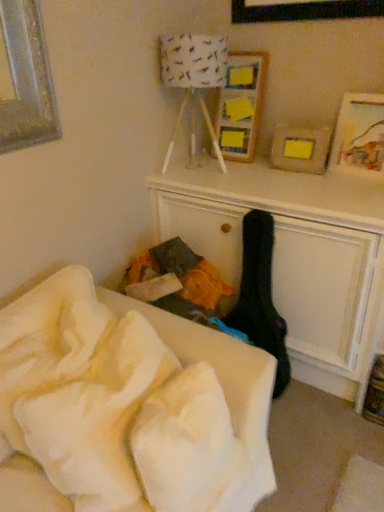
Locate an element on the screen. The width and height of the screenshot is (384, 512). wooden painted picture frame at upper right, the second picture frame viewed from the left is located at coordinates (360, 135).

This screenshot has width=384, height=512. Describe the element at coordinates (192, 68) in the screenshot. I see `white paper lampshade at upper center` at that location.

Describe the element at coordinates (260, 296) in the screenshot. I see `black fabric guitar case at center` at that location.

The height and width of the screenshot is (512, 384). Find the location of `wooden painted picture frame at upper right, the second picture frame viewed from the left`. wooden painted picture frame at upper right, the second picture frame viewed from the left is located at coordinates (360, 135).

Is black fabric guitar case at center positioned with its back to wooden painted picture frame at upper right, the second picture frame viewed from the left?

Yes, wooden painted picture frame at upper right, the second picture frame viewed from the left, is at the back of black fabric guitar case at center.

Image resolution: width=384 pixels, height=512 pixels. What are the coordinates of `the 1st picture frame above the black fabric guitar case at center (from the image's perspective)` in the screenshot? It's located at (360, 135).

Is the depth of black fabric guitar case at center greater than that of white paper lampshade at upper center?

No.

Is black fabric guitar case at center wider or thinner than white paper lampshade at upper center?

Clearly, black fabric guitar case at center has less width compared to white paper lampshade at upper center.

From a real-world perspective, which is physically above, black fabric guitar case at center or white paper lampshade at upper center?

From a 3D spatial view, white paper lampshade at upper center is above.

How distant is wooden painted picture frame at upper right, the second picture frame viewed from the left, from white paper lampshade at upper center?

wooden painted picture frame at upper right, the second picture frame viewed from the left, and white paper lampshade at upper center are 25.96 inches apart from each other.

Find the location of a particular element. picture frame located below the white paper lampshade at upper center (from the image's perspective) is located at coordinates (360, 135).

Who is more distant, wooden painted picture frame at upper right, the second picture frame viewed from the left, or white paper lampshade at upper center?

Positioned behind is wooden painted picture frame at upper right, the second picture frame viewed from the left.

Would you say wooden painted picture frame at upper right, the second picture frame viewed from the left, contains white paper lampshade at upper center?

No, white paper lampshade at upper center is not a part of wooden painted picture frame at upper right, the second picture frame viewed from the left.

Can you confirm if wooden painted picture frame at upper right, which is the first picture frame from right to left, is bigger than white soft blanket at lower left?

Incorrect, wooden painted picture frame at upper right, which is the first picture frame from right to left, is not larger than white soft blanket at lower left.

Considering the relative sizes of wooden painted picture frame at upper right, the second picture frame viewed from the left, and white soft blanket at lower left in the image provided, is wooden painted picture frame at upper right, the second picture frame viewed from the left, wider than white soft blanket at lower left?

Incorrect, the width of wooden painted picture frame at upper right, the second picture frame viewed from the left, does not surpass that of white soft blanket at lower left.

Which point is more distant from viewer, (355, 153) or (245, 377)?

The point (355, 153) is farther from the camera.

Locate an element on the screen. The height and width of the screenshot is (512, 384). furniture located on the left of wooden painted picture frame at upper right, the second picture frame viewed from the left is located at coordinates (128, 406).

Is wooden picture frame at upper center, placed as the second picture frame when sorted from right to left, looking in the opposite direction of black fabric guitar case at center?

No, wooden picture frame at upper center, placed as the second picture frame when sorted from right to left, is not facing the opposite direction of black fabric guitar case at center.

In the scene shown: Who is taller, wooden picture frame at upper center, which is counted as the first picture frame, starting from the left, or black fabric guitar case at center?

black fabric guitar case at center.

Would you consider wooden picture frame at upper center, placed as the second picture frame when sorted from right to left, to be distant from black fabric guitar case at center?

No, wooden picture frame at upper center, placed as the second picture frame when sorted from right to left, is in close proximity to black fabric guitar case at center.

From the image's perspective, is wooden picture frame at upper center, which is counted as the first picture frame, starting from the left, under black fabric guitar case at center?

No.

Between wooden painted picture frame at upper right, the second picture frame viewed from the left, and wooden picture frame at upper center, placed as the second picture frame when sorted from right to left, which one has smaller width?

wooden painted picture frame at upper right, the second picture frame viewed from the left.

Find the location of `picture frame that appears below the wooden picture frame at upper center, which is counted as the first picture frame, starting from the left (from a real-world perspective)`. picture frame that appears below the wooden picture frame at upper center, which is counted as the first picture frame, starting from the left (from a real-world perspective) is located at coordinates (360, 135).

Does wooden painted picture frame at upper right, the second picture frame viewed from the left, turn towards wooden picture frame at upper center, placed as the second picture frame when sorted from right to left?

No, wooden painted picture frame at upper right, the second picture frame viewed from the left, does not turn towards wooden picture frame at upper center, placed as the second picture frame when sorted from right to left.

Based on the photo, from the image's perspective, is wooden picture frame at upper center, which is counted as the first picture frame, starting from the left, above or below white paper lampshade at upper center?

Clearly, from the image's perspective, wooden picture frame at upper center, which is counted as the first picture frame, starting from the left, is above white paper lampshade at upper center.

Who is shorter, wooden picture frame at upper center, which is counted as the first picture frame, starting from the left, or white paper lampshade at upper center?

wooden picture frame at upper center, which is counted as the first picture frame, starting from the left, is shorter.

Measure the distance between wooden picture frame at upper center, which is counted as the first picture frame, starting from the left, and white paper lampshade at upper center.

wooden picture frame at upper center, which is counted as the first picture frame, starting from the left, and white paper lampshade at upper center are 7.54 inches apart from each other.

From a real-world perspective, is wooden picture frame at upper center, placed as the second picture frame when sorted from right to left, below white paper lampshade at upper center?

Yes, from a real-world perspective, wooden picture frame at upper center, placed as the second picture frame when sorted from right to left, is below white paper lampshade at upper center.

The image size is (384, 512). I want to click on picture frame on the right of black fabric guitar case at center, so click(x=360, y=135).

At what (x,y) coordinates should I click in order to perform the action: click on lamp that is above the black fabric guitar case at center (from the image's perspective). Please return your answer as a coordinate pair (x, y). The width and height of the screenshot is (384, 512). Looking at the image, I should click on (192, 68).

When comparing their distances from white soft blanket at lower left, does wooden painted picture frame at upper right, the second picture frame viewed from the left, or white paper lampshade at upper center seem further?

Based on the image, wooden painted picture frame at upper right, the second picture frame viewed from the left, appears to be further to white soft blanket at lower left.

From the image, which object appears to be farther from wooden picture frame at upper center, which is counted as the first picture frame, starting from the left, white soft blanket at lower left or wooden painted picture frame at upper right, which is the first picture frame from right to left?

white soft blanket at lower left.

Based on their spatial positions, is black fabric guitar case at center or wooden picture frame at upper center, placed as the second picture frame when sorted from right to left, further from white paper lampshade at upper center?

black fabric guitar case at center lies further to white paper lampshade at upper center than the other object.

Based on their spatial positions, is white paper lampshade at upper center or wooden picture frame at upper center, which is counted as the first picture frame, starting from the left, further from wooden painted picture frame at upper right, which is the first picture frame from right to left?

white paper lampshade at upper center.

Considering their positions, is black fabric guitar case at center positioned closer to wooden painted picture frame at upper right, which is the first picture frame from right to left, than white paper lampshade at upper center?

black fabric guitar case at center is closer to wooden painted picture frame at upper right, which is the first picture frame from right to left.

Based on their spatial positions, is wooden painted picture frame at upper right, which is the first picture frame from right to left, or white soft blanket at lower left further from black fabric guitar case at center?

Among the two, white soft blanket at lower left is located further to black fabric guitar case at center.

In the scene shown: When comparing their distances from white paper lampshade at upper center, does white soft blanket at lower left or black fabric guitar case at center seem further?

The object further to white paper lampshade at upper center is white soft blanket at lower left.

Which object lies nearer to the anchor point wooden painted picture frame at upper right, which is the first picture frame from right to left, white paper lampshade at upper center or white soft blanket at lower left?

Based on the image, white paper lampshade at upper center appears to be nearer to wooden painted picture frame at upper right, which is the first picture frame from right to left.

The height and width of the screenshot is (512, 384). Identify the location of picture frame between white paper lampshade at upper center and black fabric guitar case at center in the vertical direction. (360, 135).

Identify the location of picture frame between wooden picture frame at upper center, placed as the second picture frame when sorted from right to left, and white soft blanket at lower left in the up-down direction. pyautogui.click(x=360, y=135).

At what (x,y) coordinates should I click in order to perform the action: click on picture frame between wooden picture frame at upper center, placed as the second picture frame when sorted from right to left, and black fabric guitar case at center, in the vertical direction. Please return your answer as a coordinate pair (x, y). Looking at the image, I should click on (360, 135).

The height and width of the screenshot is (512, 384). I want to click on clothing between wooden painted picture frame at upper right, which is the first picture frame from right to left, and white soft blanket at lower left, in the vertical direction, so click(x=260, y=296).